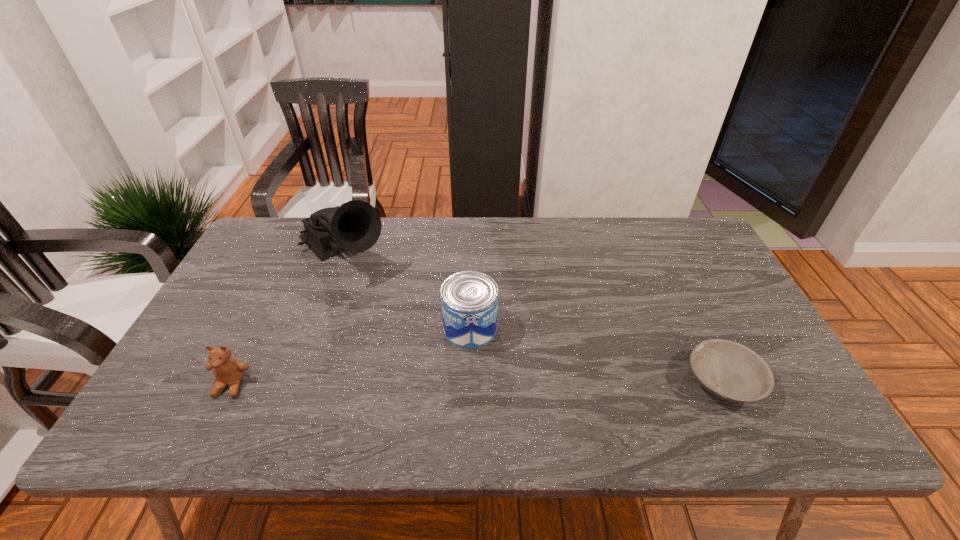
Where is `object that is at the far left corner`? The image size is (960, 540). object that is at the far left corner is located at coordinates (355, 226).

Where is `object that is at the near left corner`? The image size is (960, 540). object that is at the near left corner is located at coordinates (228, 371).

In order to click on object located at the near right corner in this screenshot , I will do `click(728, 370)`.

This screenshot has width=960, height=540. In the image, there is a desktop. Find the location of `blank space at the far edge`. blank space at the far edge is located at coordinates (650, 259).

In the image, there is a desktop. Identify the location of vacant space at the near edge. (689, 380).

You are a GUI agent. You are given a task and a screenshot of the screen. Output one action in this format:
    pyautogui.click(x=<x>, y=<y>)
    Task: Click on the vacant space at the left edge of the desktop
    This screenshot has width=960, height=540.
    Given the screenshot: What is the action you would take?
    pyautogui.click(x=266, y=267)

This screenshot has height=540, width=960. In the image, there is a desktop. Find the location of `vacant area at the right edge`. vacant area at the right edge is located at coordinates (704, 279).

In the image, there is a desktop. Identify the location of vacant space at the far left corner. (292, 257).

Locate an element on the screen. vacant space at the near left corner of the desktop is located at coordinates (218, 396).

Locate an element on the screen. The width and height of the screenshot is (960, 540). vacant space at the far right corner is located at coordinates click(686, 235).